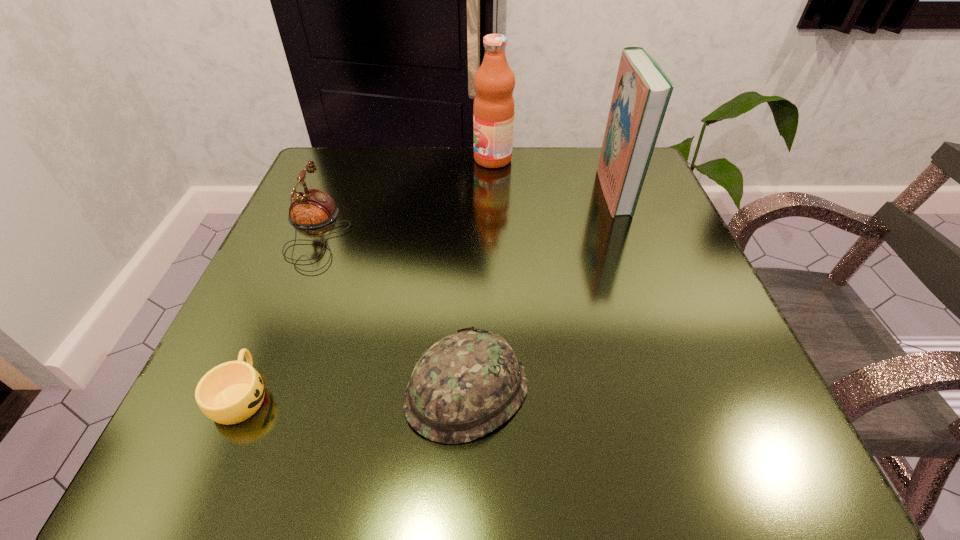
Where is `vacant space located on the cover of the rightmost object`? vacant space located on the cover of the rightmost object is located at coordinates (463, 191).

Find the location of a particular element. The width and height of the screenshot is (960, 540). vacant area situated on the rotary dial of the telephone is located at coordinates (391, 231).

Image resolution: width=960 pixels, height=540 pixels. What are the coordinates of `vacant region located 0.130m on the back of the headwear` in the screenshot? It's located at (469, 282).

Locate an element on the screen. The height and width of the screenshot is (540, 960). blank area located on the right of the cup is located at coordinates (555, 395).

This screenshot has height=540, width=960. In order to click on fruit juice that is positioned at the far edge in this screenshot , I will do `click(493, 110)`.

This screenshot has width=960, height=540. Identify the location of hardback book located in the far edge section of the desktop. (642, 91).

Locate an element on the screen. This screenshot has height=540, width=960. telephone present at the far edge is located at coordinates click(311, 208).

What are the coordinates of `headwear positioned at the near edge` in the screenshot? It's located at (467, 384).

Locate an element on the screen. cup that is at the near edge is located at coordinates (231, 392).

Locate an element on the screen. The width and height of the screenshot is (960, 540). telephone at the left edge is located at coordinates (311, 208).